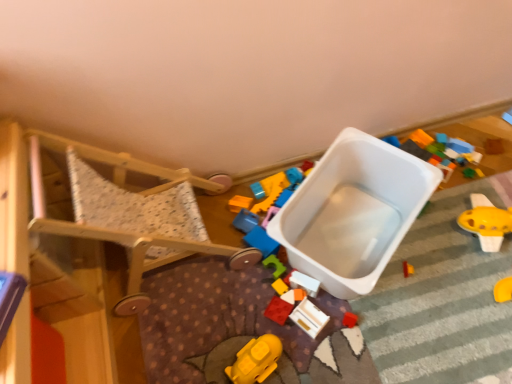
The width and height of the screenshot is (512, 384). Identify the location of free space that is in between rubber yellow toy at center, the 3th toy from the left, and yellow matte toy at lower center, placed as the 6th toy when sorted from right to left. (269, 319).